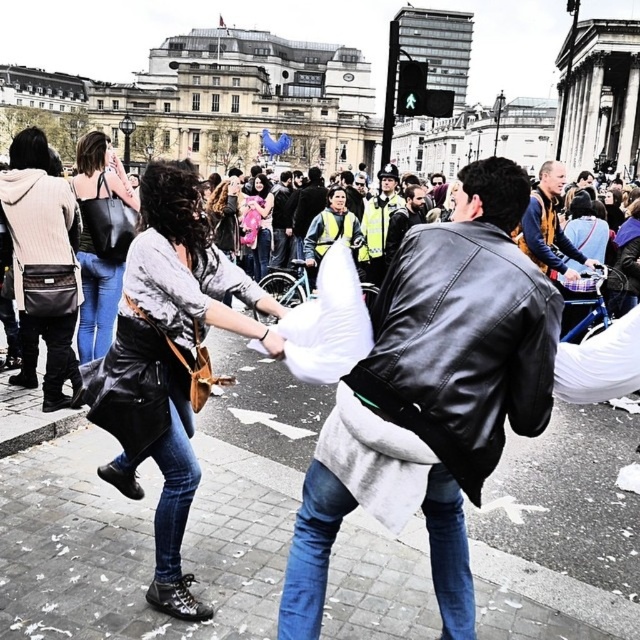
Question: Where is black leather jacket at center located in relation to yellow-orange jacket at upper right in the image?

Choices:
 (A) above
 (B) below

Answer: (B)

Question: Which of the following is the farthest from the observer?

Choices:
 (A) yellow-orange jacket at upper right
 (B) smooth concrete pavement at center

Answer: (A)

Question: Considering the real-world distances, which object is farthest from the smooth concrete pavement at center?

Choices:
 (A) reflective silver helmet at center
 (B) yellow-orange jacket at upper right

Answer: (A)

Question: Which point is closer to the camera?

Choices:
 (A) (544, 216)
 (B) (426, 582)
 (C) (387, 173)

Answer: (B)

Question: Is black leather jacket at center thinner than reflective silver helmet at center?

Choices:
 (A) no
 (B) yes

Answer: (A)

Question: In this image, where is black leather jacket at center located relative to yellow-orange jacket at upper right?

Choices:
 (A) left
 (B) right

Answer: (A)